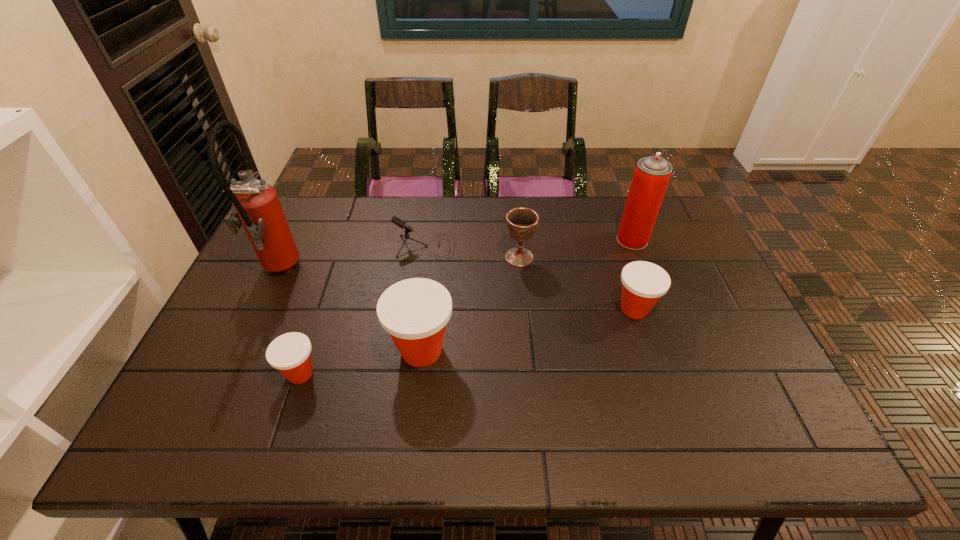
At what (x,y) coordinates should I click in order to perform the action: click on blank space located 0.220m on the back of the tallest Dixie cup. Please return your answer as a coordinate pair (x, y). Image resolution: width=960 pixels, height=540 pixels. Looking at the image, I should click on (431, 267).

You are a GUI agent. You are given a task and a screenshot of the screen. Output one action in this format:
    pyautogui.click(x=<x>, y=<y>)
    Task: Click on the free space located 0.290m on the left of the rightmost Dixie cup
    This screenshot has height=540, width=960.
    Given the screenshot: What is the action you would take?
    pyautogui.click(x=507, y=309)

At what (x,y) coordinates should I click in order to perform the action: click on vacant space situated 0.110m on the stand of the microphone. Please return your answer as a coordinate pair (x, y). Looking at the image, I should click on (490, 247).

Find the location of `free location located at the nozzle of the leftmost object`. free location located at the nozzle of the leftmost object is located at coordinates (346, 272).

Image resolution: width=960 pixels, height=540 pixels. I want to click on free location located on the left of the chalice, so click(381, 257).

Identify the location of vacant space located 0.060m on the left of the aerosol can. The height and width of the screenshot is (540, 960). (598, 240).

The height and width of the screenshot is (540, 960). I want to click on microphone that is positioned at the far edge, so click(x=402, y=224).

Locate an element on the screen. The image size is (960, 540). aerosol can that is at the far edge is located at coordinates (652, 174).

What are the coordinates of `object situated at the left edge` in the screenshot? It's located at (256, 206).

Locate an element on the screen. The width and height of the screenshot is (960, 540). object at the right edge is located at coordinates (652, 174).